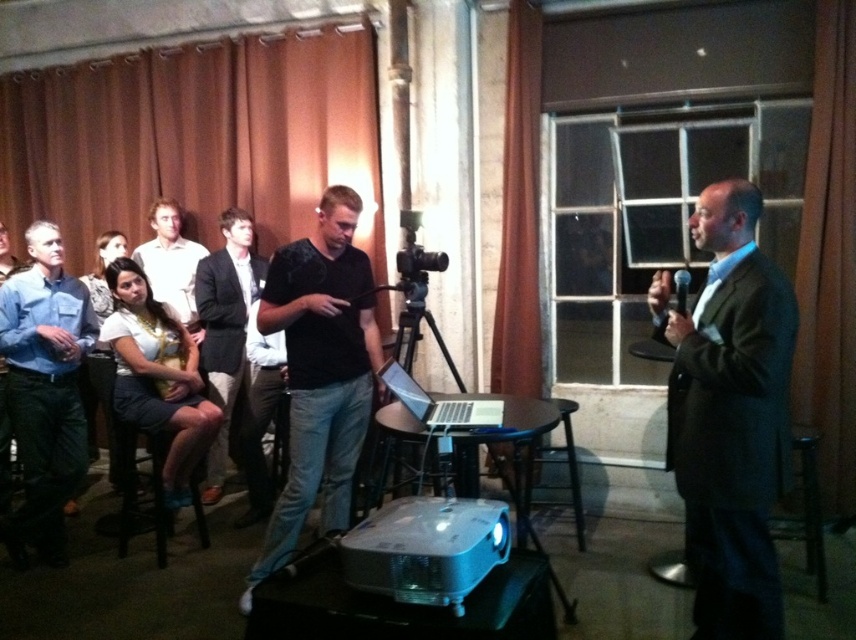
Between blue denim shirt at left and brown fabric curtain at center, which one appears on the left side from the viewer's perspective?

blue denim shirt at left

Looking at this image, can you confirm if blue denim shirt at left is smaller than brown fabric curtain at center?

No.

Who is more forward, (54,444) or (519,268)?

Point (54,444)

Where is `blue denim shirt at left`? blue denim shirt at left is located at coordinates (45, 388).

Between point (822, 358) and point (230, 388), which one is positioned in front?

Point (822, 358) is more forward.

Who is shorter, brown fabric curtain at right or black cotton shirt at center?

With less height is black cotton shirt at center.

Who is more forward, (836, 132) or (224, 320)?

Point (836, 132) is in front.

Where is `brown fabric curtain at right`? brown fabric curtain at right is located at coordinates (829, 259).

Is dark gray suit at right shorter than brown fabric curtain at center?

Indeed, dark gray suit at right has a lesser height compared to brown fabric curtain at center.

Does point (752, 627) lie behind point (507, 208)?

No, it is not.

Is point (670, 380) in front of point (536, 74)?

Yes, it is in front of point (536, 74).

Where is `dark gray suit at right`? The height and width of the screenshot is (640, 856). dark gray suit at right is located at coordinates (730, 413).